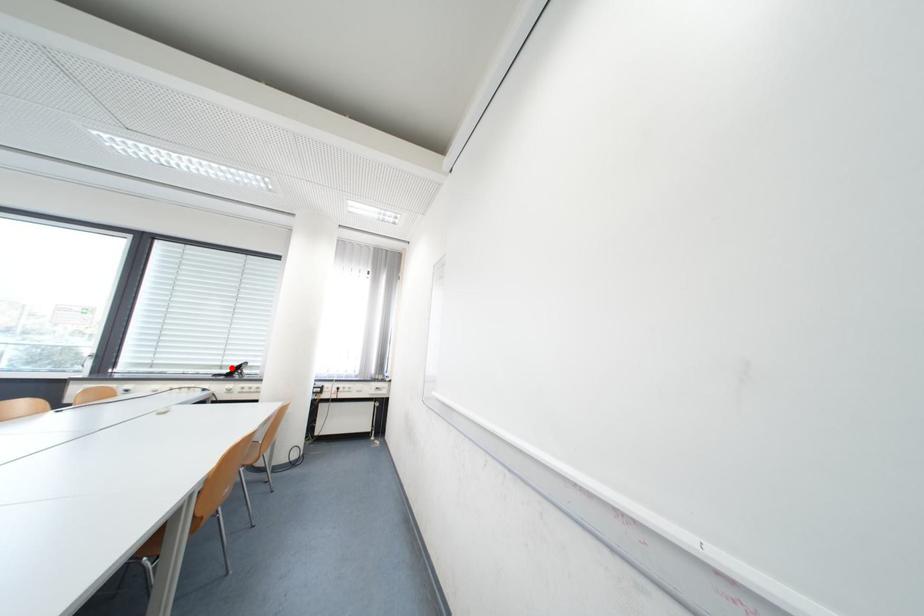
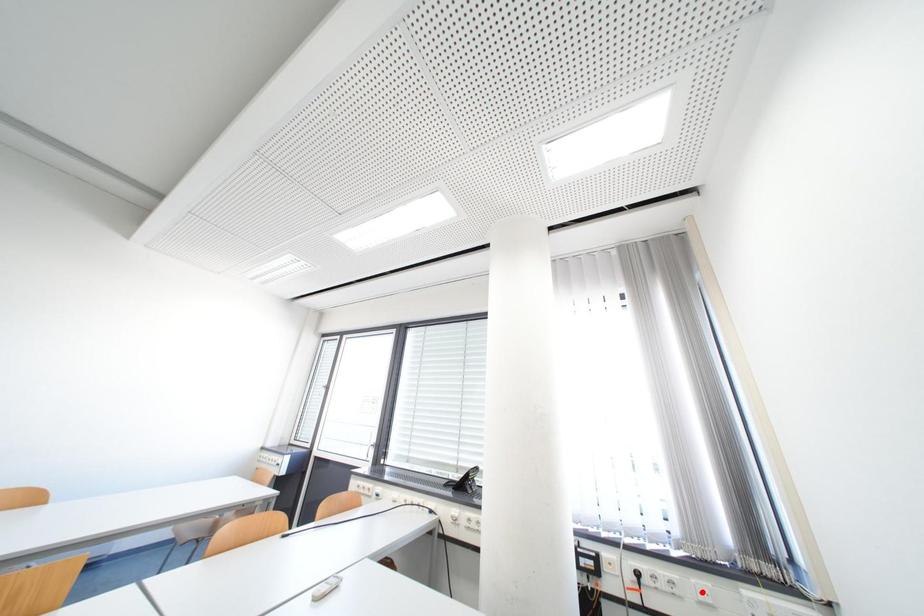
I am providing you with two images of the same scene from different viewpoints. A red point is marked on the first image and another point is marked on the second image. Is the marked point in image1 the same physical position as the marked point in image2?

No